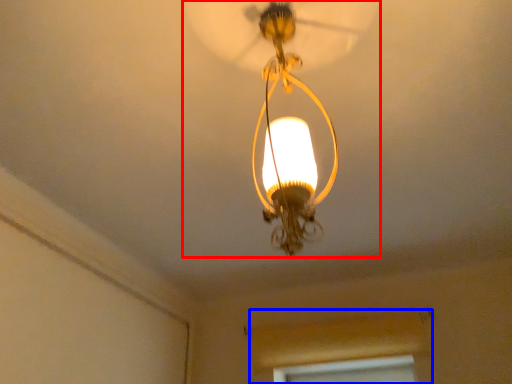
Question: Which object appears closest to the camera in this image, lamp (highlighted by a red box) or window frame (highlighted by a blue box)?

Choices:
 (A) lamp
 (B) window frame

Answer: (A)